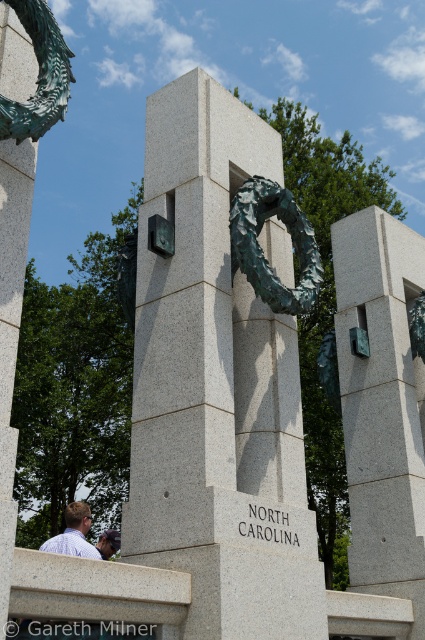
Is point (22, 196) positioned in front of point (303, 310)?

That is True.

Does point (28, 227) lie behind point (260, 224)?

That is False.

Who is more distant from viewer, (x=5, y=160) or (x=311, y=228)?

The point (x=311, y=228) is behind.

You are a GUI agent. You are given a task and a screenshot of the screen. Output one action in this format:
    pyautogui.click(x=<x>, y=<y>)
    Task: Click on the gray granite column at center
    This screenshot has height=640, width=425.
    Given the screenshot: What is the action you would take?
    pyautogui.click(x=11, y=326)

Between bronze textured wreath at center and matte gray stone at center, which one appears on the left side from the viewer's perspective?

bronze textured wreath at center is more to the left.

Between bronze textured wreath at center and matte gray stone at center, which one has more height?

Standing taller between the two is bronze textured wreath at center.

Who is more distant from viewer, (224, 122) or (402, 620)?

Point (402, 620)

Find the location of a particular element. bronze textured wreath at center is located at coordinates (218, 378).

Between light blue shirt at lower left and light blue shirt at center, which one has more height?

light blue shirt at lower left

Is point (79, 515) behind point (104, 531)?

No, (79, 515) is closer to viewer.

The image size is (425, 640). I want to click on light blue shirt at lower left, so click(73, 532).